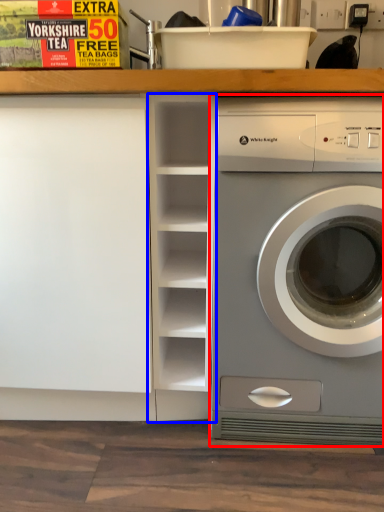
Question: Which of the following is the farthest to the observer, washing machine (highlighted by a red box) or bookshelf (highlighted by a blue box)?

Choices:
 (A) washing machine
 (B) bookshelf

Answer: (B)